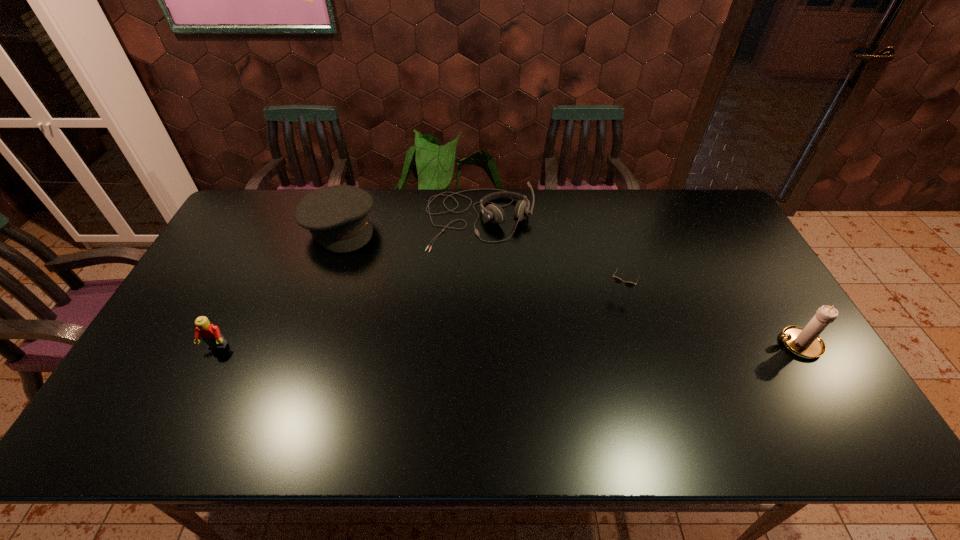
Locate an element on the screen. The image size is (960, 540). free space on the desktop that is between the Lego and the rightmost object and is positioned in front of the lenses of the fourth object from left to right is located at coordinates (593, 345).

The image size is (960, 540). Identify the location of vacant spot on the desktop that is between the leftmost object and the tallest object and is positioned on the front-facing side of the beret. (426, 346).

This screenshot has height=540, width=960. I want to click on free space on the desktop that is between the Lego and the tallest object and is positioned on the outer surface of the third object from left to right, so click(x=512, y=346).